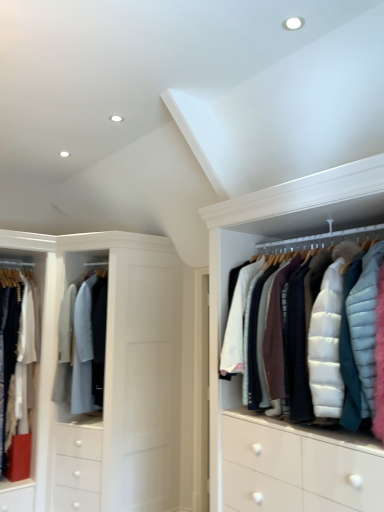
Question: From the image's perspective, is white puffy jacket at upper right located above or below light gray wool coat at center, positioned as the 2th clothing in left-to-right order?

Choices:
 (A) above
 (B) below

Answer: (A)

Question: Considering the positions of white puffy jacket at upper right and light gray wool coat at center, positioned as the 2th clothing in left-to-right order, in the image, is white puffy jacket at upper right taller or shorter than light gray wool coat at center, positioned as the 2th clothing in left-to-right order,?

Choices:
 (A) short
 (B) tall

Answer: (A)

Question: Based on their relative distances, which object is nearer to the light gray wool coat at center, positioned as the 2th clothing in left-to-right order?

Choices:
 (A) white puffy jacket at upper right
 (B) white cotton shirt at left, the second clothing in the right-to-left sequence

Answer: (B)

Question: Estimate the real-world distances between objects in this image. Which object is farther from the light gray wool coat at center, placed as the 1th clothing when sorted from right to left?

Choices:
 (A) white cotton shirt at left, the 1th clothing from the left
 (B) white puffy jacket at upper right

Answer: (B)